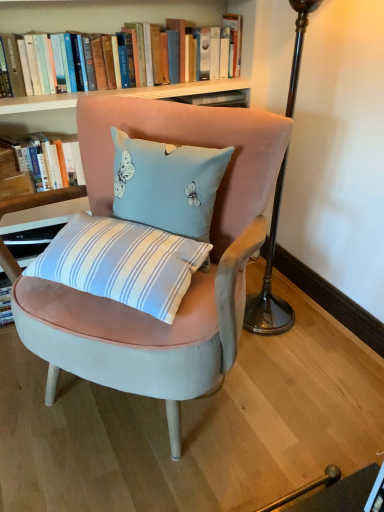
The height and width of the screenshot is (512, 384). What do you see at coordinates (49, 158) in the screenshot?
I see `hardcover book at upper left, which is counted as the 2th book, starting from the top` at bounding box center [49, 158].

This screenshot has width=384, height=512. What are the coordinates of `hardcover book at upper left, positioned as the first book in bottom-to-top order` in the screenshot? It's located at (49, 158).

The height and width of the screenshot is (512, 384). What do you see at coordinates (192, 277) in the screenshot?
I see `velvet pink chair at center` at bounding box center [192, 277].

At what (x,y) coordinates should I click in order to perform the action: click on light blue velvet cushion at center. Please return your answer as a coordinate pair (x, y). This screenshot has height=512, width=384. Looking at the image, I should click on (167, 184).

Is light blue velvet cushion at center positioned beyond the bounds of velvet pink chair at center?

No, light blue velvet cushion at center is inside or overlapping with velvet pink chair at center.

Are light blue velvet cushion at center and velvet pink chair at center located far from each other?

No, light blue velvet cushion at center is not far away from velvet pink chair at center.

Does point (209, 168) come in front of point (225, 270)?

No, it is not.

From their relative heights in the image, would you say velvet pink chair at center is taller or shorter than hardcover book at upper left, which is counted as the 2th book, starting from the top?

Clearly, velvet pink chair at center is taller compared to hardcover book at upper left, which is counted as the 2th book, starting from the top.

Which object is thinner, velvet pink chair at center or hardcover book at upper left, positioned as the first book in bottom-to-top order?

Thinner between the two is hardcover book at upper left, positioned as the first book in bottom-to-top order.

Identify the location of the 1st book directly above the velvet pink chair at center (from a real-world perspective). (49, 158).

From a real-world perspective, relative to hardcover book at upper left, positioned as the first book in bottom-to-top order, is velvet pink chair at center vertically above or below?

In terms of real-world spatial position, velvet pink chair at center is below hardcover book at upper left, positioned as the first book in bottom-to-top order.

Looking at the image, does hardcover book at upper left, which is counted as the 2th book, starting from the top, seem bigger or smaller compared to velvet pink chair at center?

hardcover book at upper left, which is counted as the 2th book, starting from the top, is smaller than velvet pink chair at center.

Does hardcover book at upper left, which is counted as the 2th book, starting from the top, appear on the left side of velvet pink chair at center?

Correct, you'll find hardcover book at upper left, which is counted as the 2th book, starting from the top, to the left of velvet pink chair at center.

Is hardcover book at upper left, positioned as the first book in bottom-to-top order, completely or partially outside of velvet pink chair at center?

Yes.

Does point (34, 172) appear closer or farther from the camera than point (91, 335)?

Clearly, point (34, 172) is more distant from the camera than point (91, 335).

How far apart are hardcover book at upper left, positioned as the first book in bottom-to-top order, and light blue velvet cushion at center?

A: 24.66 inches.

The height and width of the screenshot is (512, 384). Identify the location of the 1st book above the light blue velvet cushion at center (from the image's perspective). (49, 158).

Is light blue velvet cushion at center completely or partially inside hardcover book at upper left, positioned as the first book in bottom-to-top order?

No.

Is hardcover book at upper left, positioned as the first book in bottom-to-top order, to the right of light blue velvet cushion at center from the viewer's perspective?

No, hardcover book at upper left, positioned as the first book in bottom-to-top order, is not to the right of light blue velvet cushion at center.

Can you tell me how much light blue velvet cushion at center and hardcover books at upper center, the second book in the bottom-to-top sequence, differ in facing direction?

There is a 49.7-degree angle between the facing directions of light blue velvet cushion at center and hardcover books at upper center, the second book in the bottom-to-top sequence.

Relative to hardcover books at upper center, marked as the 1th book in a top-to-bottom arrangement, is light blue velvet cushion at center in front or behind?

light blue velvet cushion at center is positioned closer to the viewer than hardcover books at upper center, marked as the 1th book in a top-to-bottom arrangement.

Is there a large distance between light blue velvet cushion at center and hardcover books at upper center, the second book in the bottom-to-top sequence?

No, light blue velvet cushion at center is not far from hardcover books at upper center, the second book in the bottom-to-top sequence.

Can hardcover books at upper center, marked as the 1th book in a top-to-bottom arrangement, be found inside light blue velvet cushion at center?

No, hardcover books at upper center, marked as the 1th book in a top-to-bottom arrangement, is located outside of light blue velvet cushion at center.

Considering the sizes of objects velvet pink chair at center and light blue velvet cushion at center in the image provided, who is shorter, velvet pink chair at center or light blue velvet cushion at center?

Standing shorter between the two is light blue velvet cushion at center.

Between velvet pink chair at center and light blue velvet cushion at center, which one has smaller width?

light blue velvet cushion at center.

Is velvet pink chair at center not near light blue velvet cushion at center?

velvet pink chair at center is actually quite close to light blue velvet cushion at center.

Is velvet pink chair at center facing towards light blue velvet cushion at center?

Yes, velvet pink chair at center is facing light blue velvet cushion at center.

Is velvet pink chair at center outside of hardcover books at upper center, marked as the 1th book in a top-to-bottom arrangement?

Absolutely, velvet pink chair at center is external to hardcover books at upper center, marked as the 1th book in a top-to-bottom arrangement.

Can you confirm if velvet pink chair at center is thinner than hardcover books at upper center, the second book in the bottom-to-top sequence?

No.

Would you consider velvet pink chair at center to be distant from hardcover books at upper center, the second book in the bottom-to-top sequence?

No, there isn't a large distance between velvet pink chair at center and hardcover books at upper center, the second book in the bottom-to-top sequence.

This screenshot has width=384, height=512. What are the coordinates of `chair on the left of light blue velvet cushion at center` in the screenshot? It's located at (192, 277).

Starting from the velvet pink chair at center, which book is the 2nd one behind? Please provide its 2D coordinates.

[(49, 158)]

Considering their positions, is hardcover book at upper left, which is counted as the 2th book, starting from the top, positioned further to light blue velvet cushion at center than velvet pink chair at center?

hardcover book at upper left, which is counted as the 2th book, starting from the top, is positioned further to the anchor light blue velvet cushion at center.

Estimate the real-world distances between objects in this image. Which object is further from velvet pink chair at center, hardcover books at upper center, marked as the 1th book in a top-to-bottom arrangement, or hardcover book at upper left, which is counted as the 2th book, starting from the top?

Among the two, hardcover books at upper center, marked as the 1th book in a top-to-bottom arrangement, is located further to velvet pink chair at center.

From the image, which object appears to be farther from velvet pink chair at center, light blue velvet cushion at center or hardcover books at upper center, marked as the 1th book in a top-to-bottom arrangement?

Based on the image, hardcover books at upper center, marked as the 1th book in a top-to-bottom arrangement, appears to be further to velvet pink chair at center.

Looking at the image, which one is located closer to hardcover books at upper center, the second book in the bottom-to-top sequence, light blue velvet cushion at center or hardcover book at upper left, which is counted as the 2th book, starting from the top?

hardcover book at upper left, which is counted as the 2th book, starting from the top, is positioned closer to the anchor hardcover books at upper center, the second book in the bottom-to-top sequence.

When comparing their distances from hardcover books at upper center, the second book in the bottom-to-top sequence, does velvet pink chair at center or hardcover book at upper left, which is counted as the 2th book, starting from the top, seem further?

velvet pink chair at center lies further to hardcover books at upper center, the second book in the bottom-to-top sequence, than the other object.

Which object lies further to the anchor point light blue velvet cushion at center, hardcover books at upper center, the second book in the bottom-to-top sequence, or hardcover book at upper left, positioned as the first book in bottom-to-top order?

Based on the image, hardcover books at upper center, the second book in the bottom-to-top sequence, appears to be further to light blue velvet cushion at center.

When comparing their distances from velvet pink chair at center, does hardcover book at upper left, which is counted as the 2th book, starting from the top, or hardcover books at upper center, marked as the 1th book in a top-to-bottom arrangement, seem further?

hardcover books at upper center, marked as the 1th book in a top-to-bottom arrangement, is positioned further to the anchor velvet pink chair at center.

Based on their spatial positions, is light blue velvet cushion at center or hardcover books at upper center, the second book in the bottom-to-top sequence, closer to hardcover book at upper left, positioned as the first book in bottom-to-top order?

hardcover books at upper center, the second book in the bottom-to-top sequence.

I want to click on book between hardcover books at upper center, marked as the 1th book in a top-to-bottom arrangement, and light blue velvet cushion at center from top to bottom, so click(x=49, y=158).

At what (x,y) coordinates should I click in order to perform the action: click on pillow between hardcover books at upper center, the second book in the bottom-to-top sequence, and velvet pink chair at center vertically. Please return your answer as a coordinate pair (x, y). Looking at the image, I should click on (167, 184).

Find the location of a particular element. The width and height of the screenshot is (384, 512). book between velvet pink chair at center and hardcover book at upper left, which is counted as the 2th book, starting from the top, from front to back is located at coordinates (105, 14).

Locate an element on the screen. pillow between velvet pink chair at center and hardcover book at upper left, positioned as the first book in bottom-to-top order, along the z-axis is located at coordinates (167, 184).